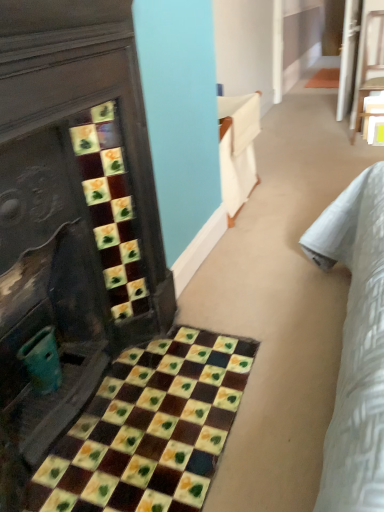
Question: Considering the relative positions of wooden chair at upper right and teal plastic cup at lower left in the image provided, is wooden chair at upper right to the left of teal plastic cup at lower left from the viewer's perspective?

Choices:
 (A) no
 (B) yes

Answer: (A)

Question: Is wooden chair at upper right positioned in front of teal plastic cup at lower left?

Choices:
 (A) yes
 (B) no

Answer: (B)

Question: Can you see wooden chair at upper right touching teal plastic cup at lower left?

Choices:
 (A) yes
 (B) no

Answer: (B)

Question: Does wooden chair at upper right have a greater height compared to teal plastic cup at lower left?

Choices:
 (A) yes
 (B) no

Answer: (A)

Question: Is the depth of wooden chair at upper right greater than that of teal plastic cup at lower left?

Choices:
 (A) no
 (B) yes

Answer: (B)

Question: Does wooden chair at upper right have a larger size compared to teal plastic cup at lower left?

Choices:
 (A) no
 (B) yes

Answer: (B)

Question: Can you confirm if yellow matte square at center is bigger than teal plastic cup at lower left?

Choices:
 (A) no
 (B) yes

Answer: (A)

Question: Is yellow matte square at center not inside teal plastic cup at lower left?

Choices:
 (A) no
 (B) yes

Answer: (B)

Question: Considering the relative sizes of yellow matte square at center and teal plastic cup at lower left in the image provided, is yellow matte square at center wider than teal plastic cup at lower left?

Choices:
 (A) yes
 (B) no

Answer: (B)

Question: Can you confirm if yellow matte square at center is smaller than teal plastic cup at lower left?

Choices:
 (A) no
 (B) yes

Answer: (B)

Question: Can you confirm if yellow matte square at center is positioned to the right of teal plastic cup at lower left?

Choices:
 (A) yes
 (B) no

Answer: (A)

Question: Does yellow matte square at center have a lesser width compared to teal plastic cup at lower left?

Choices:
 (A) yes
 (B) no

Answer: (A)

Question: Does multicolored mosaic tiles at lower left have a lesser height compared to wooden chair at upper right?

Choices:
 (A) yes
 (B) no

Answer: (A)